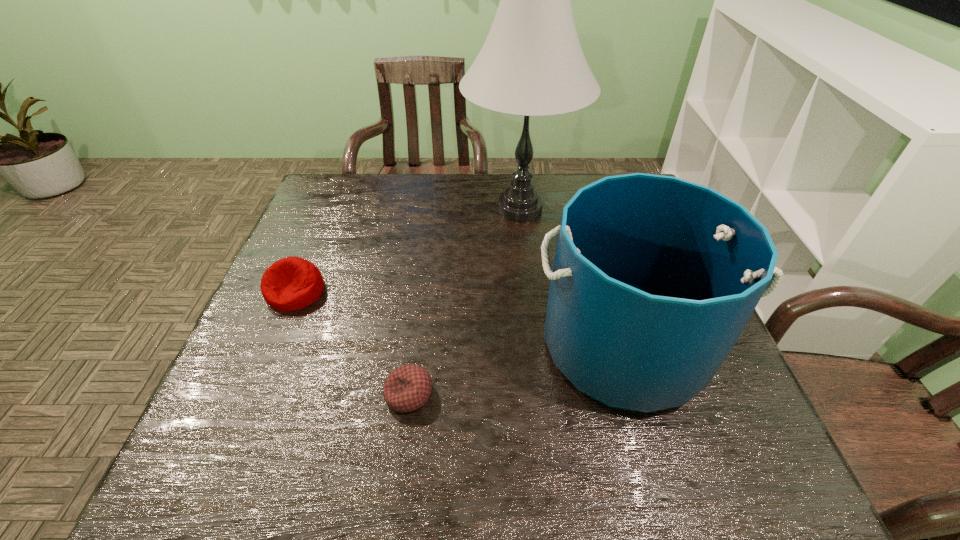
The image size is (960, 540). Identify the location of lamp. (532, 64).

Locate an element on the screen. This screenshot has width=960, height=540. the tallest object is located at coordinates (532, 64).

This screenshot has height=540, width=960. I want to click on the third shortest object, so click(654, 278).

Find the location of a particular element. This screenshot has height=540, width=960. the taller beanbag is located at coordinates pyautogui.click(x=292, y=283).

Locate an element on the screen. the leftmost object is located at coordinates (292, 283).

Find the location of a particular element. the shortest object is located at coordinates (407, 388).

Where is `the right beanbag`? the right beanbag is located at coordinates (407, 388).

Locate an element on the screen. free space located 0.300m on the front of the farthest object is located at coordinates (534, 330).

At what (x,y) coordinates should I click in order to perform the action: click on free space located 0.300m on the left of the third shortest object. Please return your answer as a coordinate pair (x, y). This screenshot has height=540, width=960. Looking at the image, I should click on (395, 346).

This screenshot has width=960, height=540. In order to click on free space located on the seat area of the third tallest object in this screenshot , I will do point(278,333).